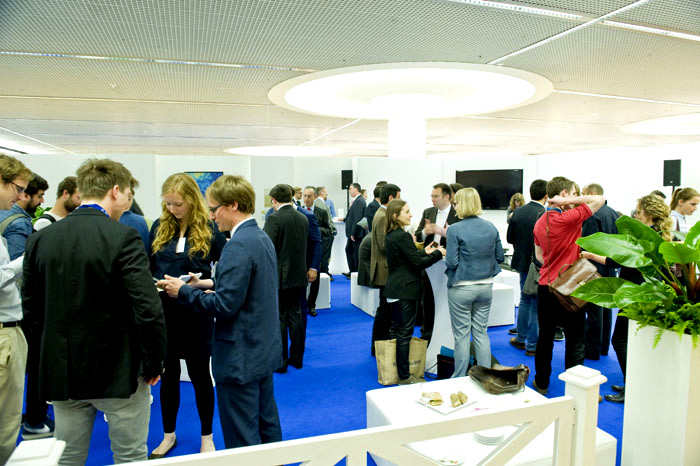
Identify the location of table. The height and width of the screenshot is (466, 700). (393, 394).